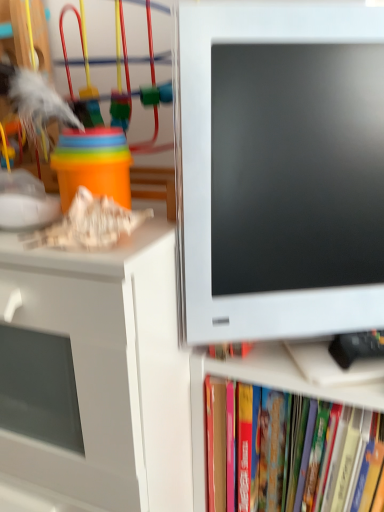
Question: Considering the relative positions of satin white monitor at right and matte plastic cups at upper left in the image provided, is satin white monitor at right to the left of matte plastic cups at upper left from the viewer's perspective?

Choices:
 (A) yes
 (B) no

Answer: (B)

Question: Is satin white monitor at right outside of matte plastic cups at upper left?

Choices:
 (A) yes
 (B) no

Answer: (A)

Question: Is satin white monitor at right positioned in front of matte plastic cups at upper left?

Choices:
 (A) yes
 (B) no

Answer: (A)

Question: Is satin white monitor at right thinner than matte plastic cups at upper left?

Choices:
 (A) no
 (B) yes

Answer: (B)

Question: From a real-world perspective, is satin white monitor at right below matte plastic cups at upper left?

Choices:
 (A) no
 (B) yes

Answer: (B)

Question: Is satin white monitor at right positioned behind matte plastic cups at upper left?

Choices:
 (A) yes
 (B) no

Answer: (B)

Question: Is satin white monitor at right not within white glossy cabinet at left?

Choices:
 (A) no
 (B) yes

Answer: (B)

Question: Can you confirm if satin white monitor at right is bigger than white glossy cabinet at left?

Choices:
 (A) yes
 (B) no

Answer: (B)

Question: From a real-world perspective, is satin white monitor at right physically below white glossy cabinet at left?

Choices:
 (A) yes
 (B) no

Answer: (B)

Question: Is satin white monitor at right thinner than white glossy cabinet at left?

Choices:
 (A) no
 (B) yes

Answer: (B)

Question: Considering the relative sizes of satin white monitor at right and white glossy cabinet at left in the image provided, is satin white monitor at right wider than white glossy cabinet at left?

Choices:
 (A) no
 (B) yes

Answer: (A)

Question: Would you say satin white monitor at right contains white glossy cabinet at left?

Choices:
 (A) yes
 (B) no

Answer: (B)

Question: From a real-world perspective, is hardcover book at lower right on top of satin white monitor at right?

Choices:
 (A) no
 (B) yes

Answer: (A)